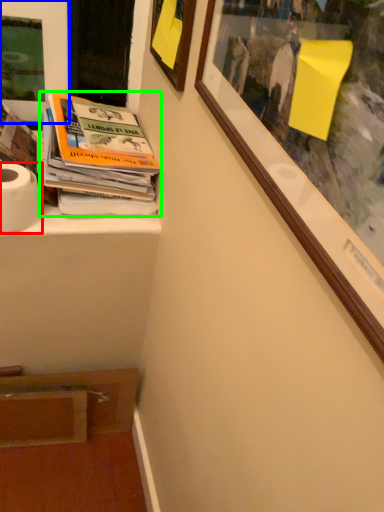
Question: Which is nearer to the toilet paper (highlighted by a red box)? picture frame (highlighted by a blue box) or book (highlighted by a green box).

Choices:
 (A) picture frame
 (B) book

Answer: (B)